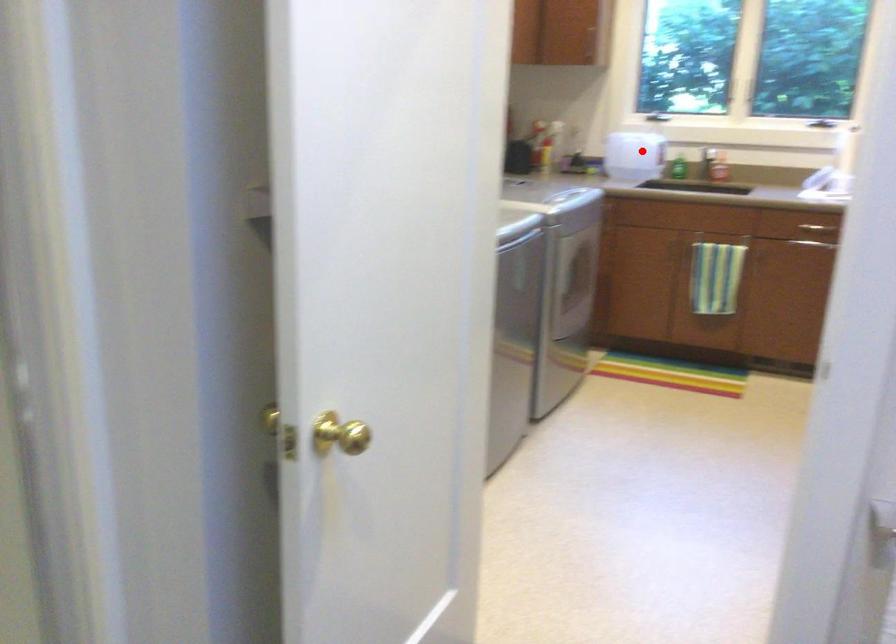
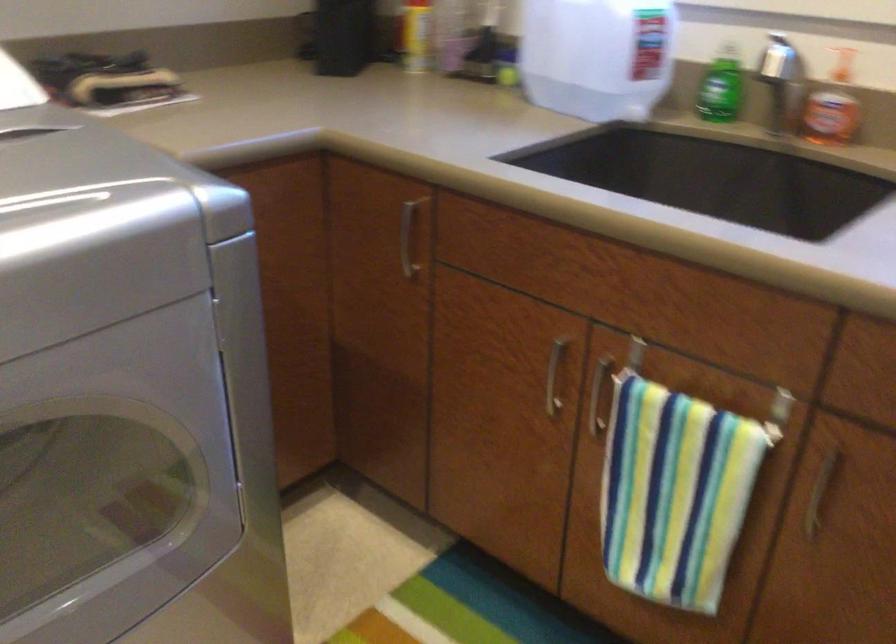
Question: I am providing you with two images of the same scene from different viewpoints. A red point is shown in image1. For the corresponding object point in image2, is it positioned nearer or farther from the camera?

Choices:
 (A) Nearer
 (B) Farther

Answer: (A)